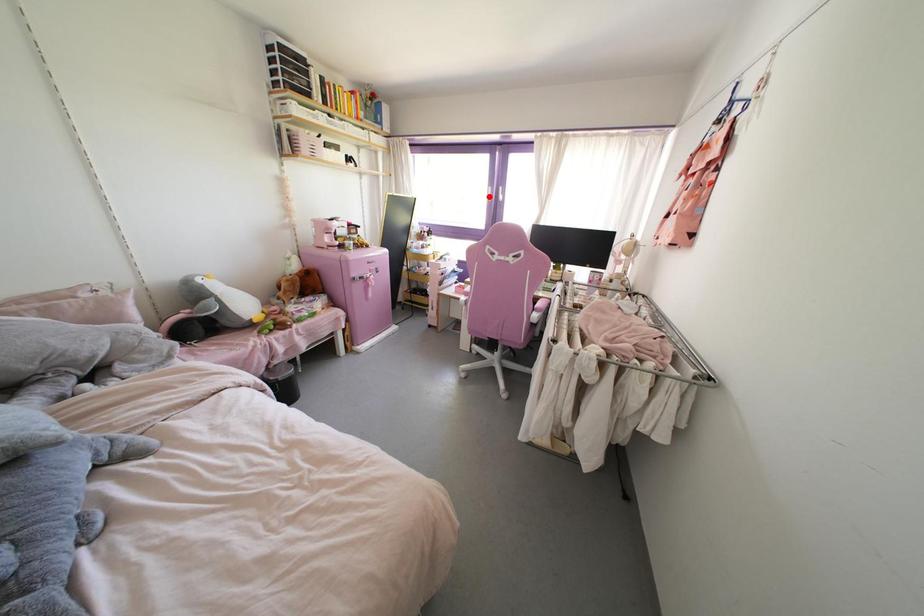
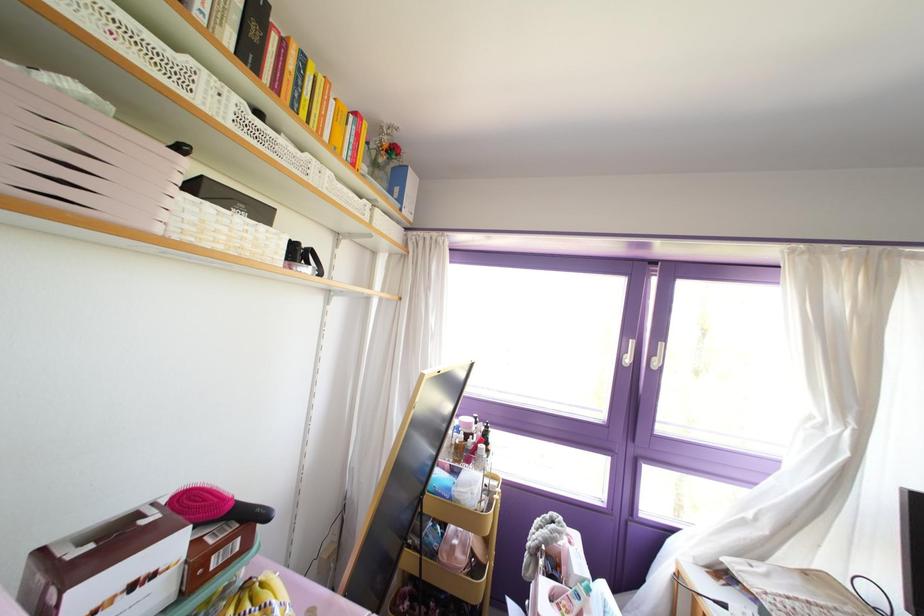
Question: I am providing you with two images of the same scene from different viewpoints. Given a red point in image1, look at the same physical point in image2. Is it:

Choices:
 (A) Closer to the viewpoint
 (B) Farther from the viewpoint

Answer: (B)